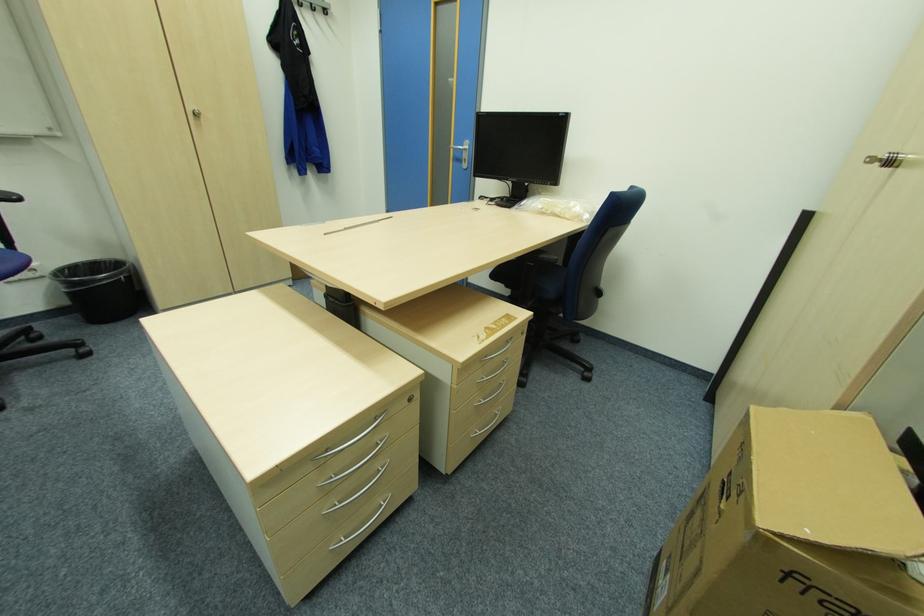
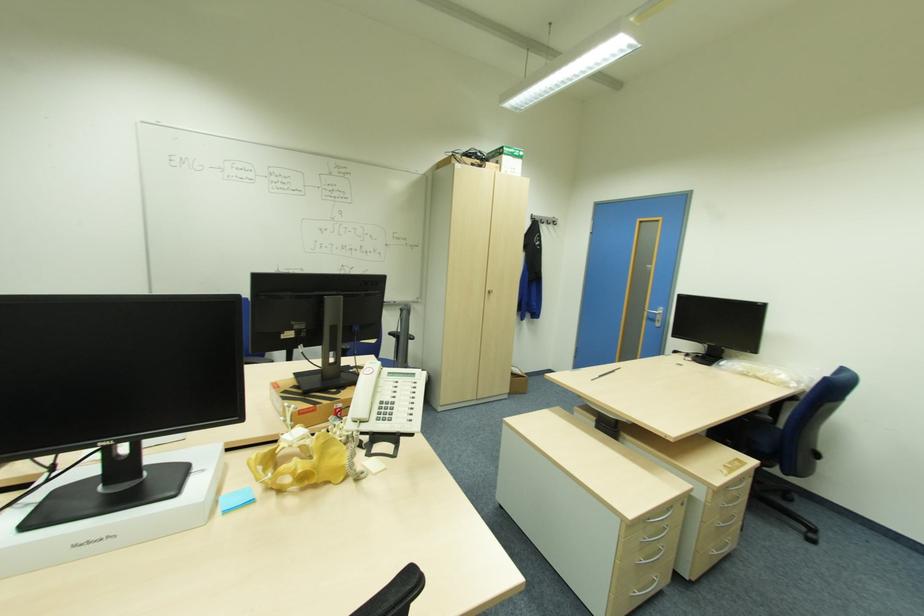
In the second image, find the point that corresponds to pixel 198 114 in the first image.

(492, 292)